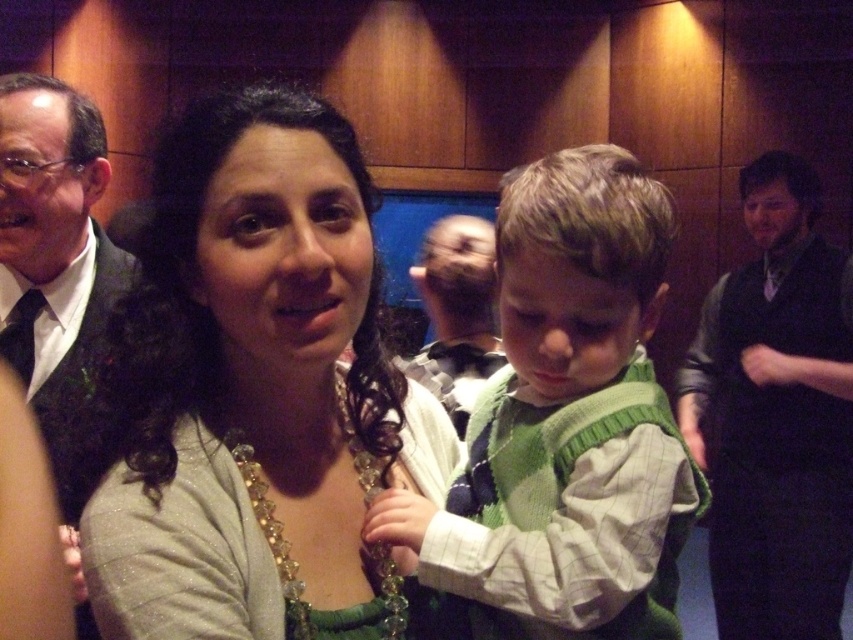
Question: Can you confirm if green knit sweater at center is positioned to the right of crystal glass necklace at center?

Choices:
 (A) yes
 (B) no

Answer: (A)

Question: Based on their relative distances, which object is farther from the green knit sweater at center?

Choices:
 (A) green knitted sweater at center
 (B) black satin tie at left
 (C) crystal glass necklace at center
 (D) matte gray sweater at center

Answer: (C)

Question: Is matte black suit at left smaller than black satin tie at left?

Choices:
 (A) no
 (B) yes

Answer: (A)

Question: Can you confirm if green knitted sweater at center is thinner than green knit sweater at center?

Choices:
 (A) no
 (B) yes

Answer: (A)

Question: Which object is positioned closest to the crystal glass necklace at center?

Choices:
 (A) black satin tie at left
 (B) green knitted sweater at center

Answer: (B)

Question: Among these objects, which one is farthest from the camera?

Choices:
 (A) black satin tie at left
 (B) matte gray sweater at center
 (C) black sweater at right
 (D) crystal glass necklace at center

Answer: (C)